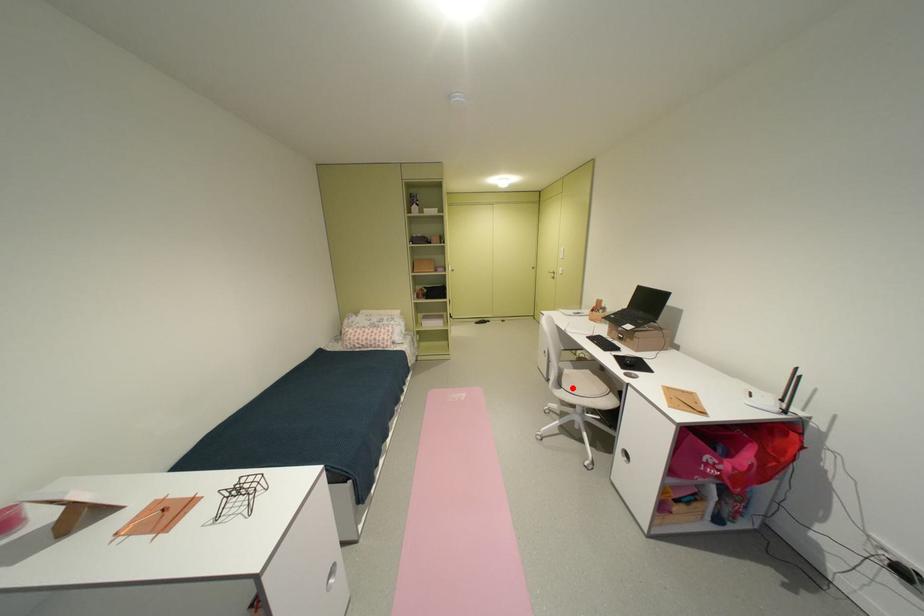
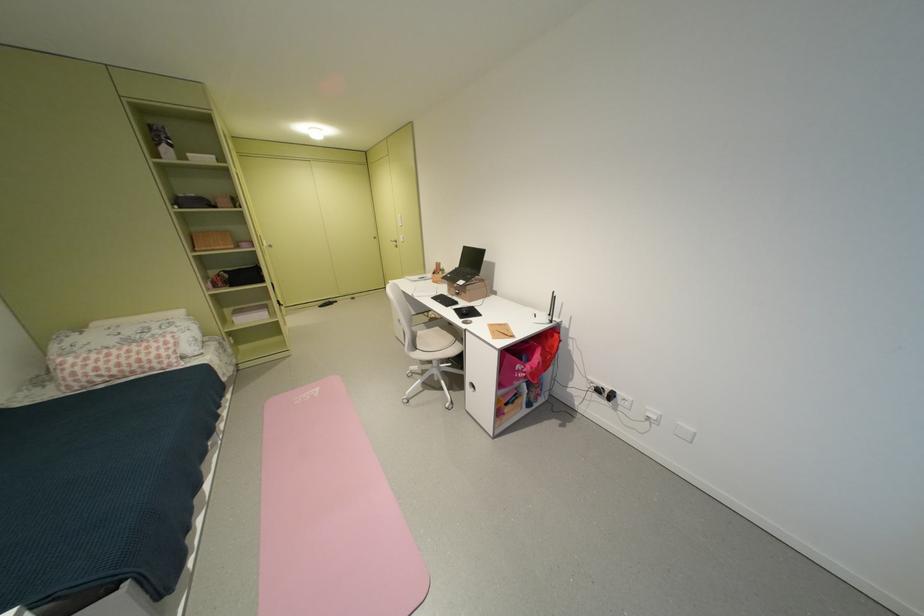
Question: A red point is marked in image1. In image2, is the corresponding 3D point closer to the camera or farther? Reply with the corresponding letter.

Choices:
 (A) The corresponding 3D point is closer.
 (B) The corresponding 3D point is farther.

Answer: (B)